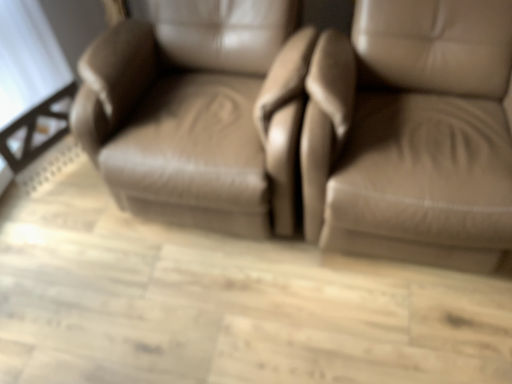
Question: Considering the relative positions of matte leather chair at right, which is the 2th chair in left-to-right order, and matte leather chair at center, positioned as the first chair in left-to-right order, in the image provided, is matte leather chair at right, which is the 2th chair in left-to-right order, to the right of matte leather chair at center, positioned as the first chair in left-to-right order, from the viewer's perspective?

Choices:
 (A) yes
 (B) no

Answer: (A)

Question: Is matte leather chair at right, which is the 2th chair in left-to-right order, beside matte leather chair at center, the second chair when ordered from right to left?

Choices:
 (A) yes
 (B) no

Answer: (B)

Question: Does matte leather chair at right, placed as the first chair when sorted from right to left, come behind matte leather chair at center, the second chair when ordered from right to left?

Choices:
 (A) no
 (B) yes

Answer: (A)

Question: Is matte leather chair at right, placed as the first chair when sorted from right to left, turned away from matte leather chair at center, the second chair when ordered from right to left?

Choices:
 (A) yes
 (B) no

Answer: (B)

Question: Is matte leather chair at right, placed as the first chair when sorted from right to left, not inside matte leather chair at center, the second chair when ordered from right to left?

Choices:
 (A) no
 (B) yes

Answer: (B)

Question: Does matte leather chair at right, placed as the first chair when sorted from right to left, have a smaller size compared to matte leather chair at center, positioned as the first chair in left-to-right order?

Choices:
 (A) yes
 (B) no

Answer: (B)

Question: Does matte leather chair at center, the second chair when ordered from right to left, come in front of matte leather chair at right, placed as the first chair when sorted from right to left?

Choices:
 (A) yes
 (B) no

Answer: (B)

Question: Can you confirm if matte leather chair at center, the second chair when ordered from right to left, is taller than matte leather chair at right, placed as the first chair when sorted from right to left?

Choices:
 (A) no
 (B) yes

Answer: (A)

Question: Can you confirm if matte leather chair at center, positioned as the first chair in left-to-right order, is smaller than matte leather chair at right, which is the 2th chair in left-to-right order?

Choices:
 (A) yes
 (B) no

Answer: (A)

Question: From a real-world perspective, is matte leather chair at center, the second chair when ordered from right to left, positioned over matte leather chair at right, which is the 2th chair in left-to-right order, based on gravity?

Choices:
 (A) no
 (B) yes

Answer: (A)

Question: Is matte leather chair at center, positioned as the first chair in left-to-right order, facing towards matte leather chair at right, which is the 2th chair in left-to-right order?

Choices:
 (A) yes
 (B) no

Answer: (B)

Question: Can you confirm if matte leather chair at center, positioned as the first chair in left-to-right order, is positioned to the left of matte leather chair at right, placed as the first chair when sorted from right to left?

Choices:
 (A) no
 (B) yes

Answer: (B)

Question: In terms of height, does matte leather chair at center, positioned as the first chair in left-to-right order, look taller or shorter compared to matte leather chair at right, placed as the first chair when sorted from right to left?

Choices:
 (A) tall
 (B) short

Answer: (B)